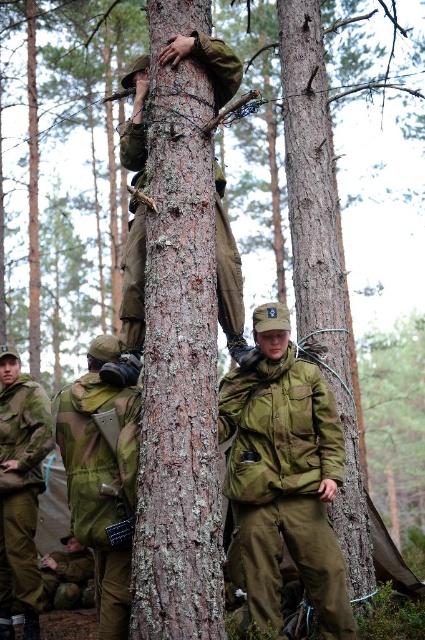
Between point (342, 552) and point (68, 538), which one is positioned behind?

Positioned behind is point (68, 538).

Is point (303, 189) farther from viewer compared to point (70, 534)?

No, (303, 189) is closer to viewer.

Where is `brown rough bark at center`? brown rough bark at center is located at coordinates (309, 168).

Can you confirm if matte green uniform at center is shorter than camouflage fabric backpack at center?

Incorrect, matte green uniform at center's height does not fall short of camouflage fabric backpack at center's.

Is matte green uniform at center to the left of camouflage fabric backpack at center from the viewer's perspective?

Incorrect, matte green uniform at center is not on the left side of camouflage fabric backpack at center.

Between point (238, 440) and point (102, 524), which one is positioned behind?

The point (238, 440) is more distant.

Locate an element on the screen. The height and width of the screenshot is (640, 425). matte green uniform at center is located at coordinates (285, 481).

Does matte green uniform at center have a greater width compared to brown rough bark at center?

Correct, the width of matte green uniform at center exceeds that of brown rough bark at center.

Is point (249, 593) positioned after point (288, 179)?

No, it is in front of (288, 179).

The width and height of the screenshot is (425, 640). What do you see at coordinates (285, 481) in the screenshot? I see `matte green uniform at center` at bounding box center [285, 481].

Find the location of a particular element. Image resolution: width=425 pixels, height=640 pixels. matte green uniform at center is located at coordinates (285, 481).